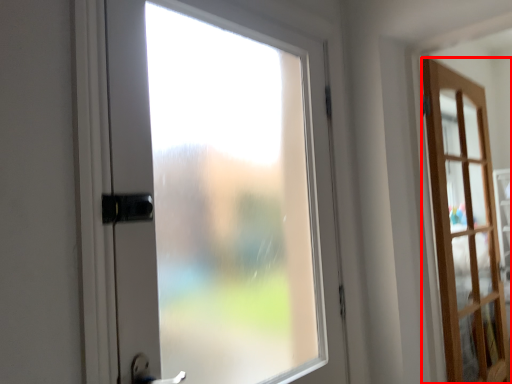
Question: Considering the relative positions of door (annotated by the red box) and door in the image provided, where is door (annotated by the red box) located with respect to the staircase?

Choices:
 (A) left
 (B) right

Answer: (B)